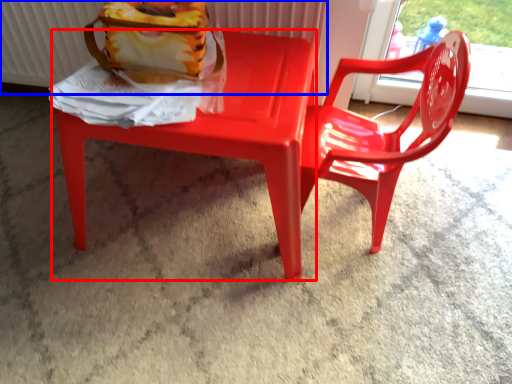
Question: Which object appears farthest to the camera in this image, chair (highlighted by a red box) or radiator (highlighted by a blue box)?

Choices:
 (A) chair
 (B) radiator

Answer: (B)